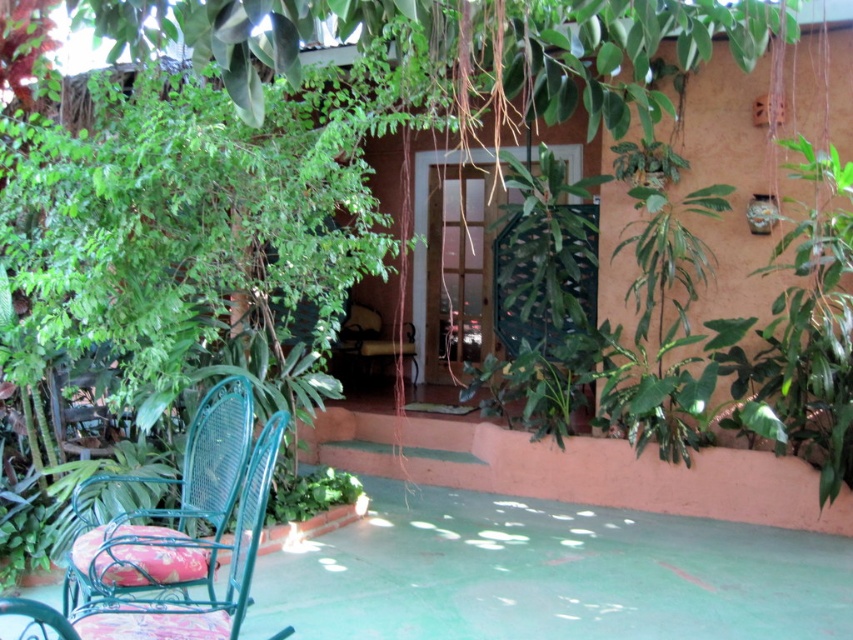
Does green wicker chair at lower left appear on the right side of metallic green chair at center?

In fact, green wicker chair at lower left is to the left of metallic green chair at center.

Who is more distant from viewer, (204, 497) or (350, 308)?

Point (350, 308)

Measure the distance between point (114, 548) and camera.

2.64 meters

This screenshot has height=640, width=853. I want to click on green wicker chair at lower left, so tap(167, 513).